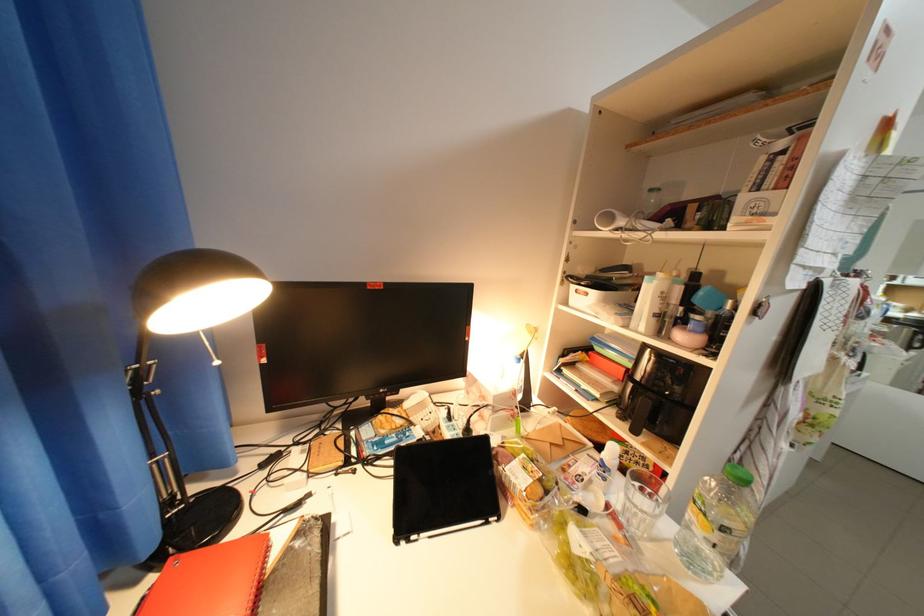
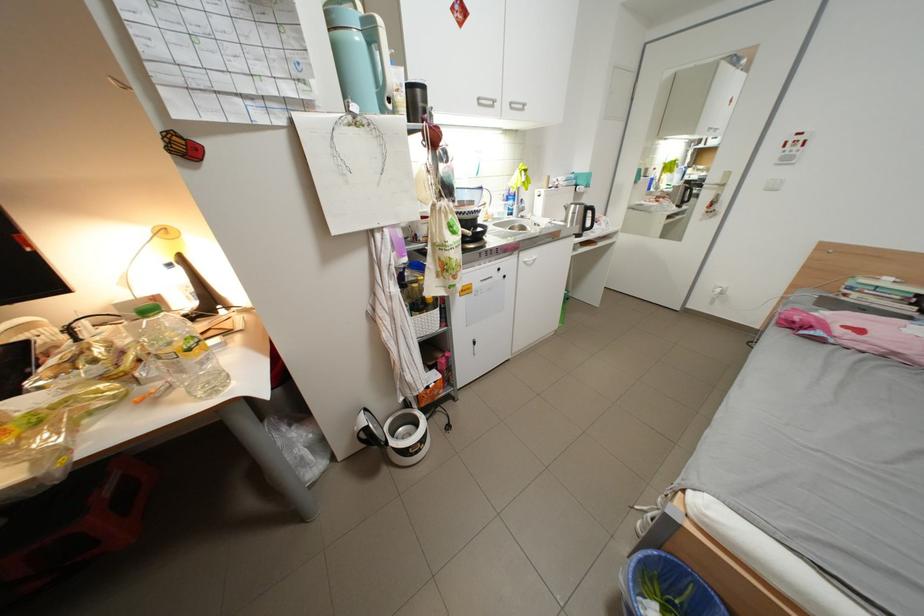
Question: In a continuous first-person perspective shot, in which direction is the camera moving?

Choices:
 (A) Left
 (B) Right
 (C) Forward
 (D) Backward

Answer: (B)